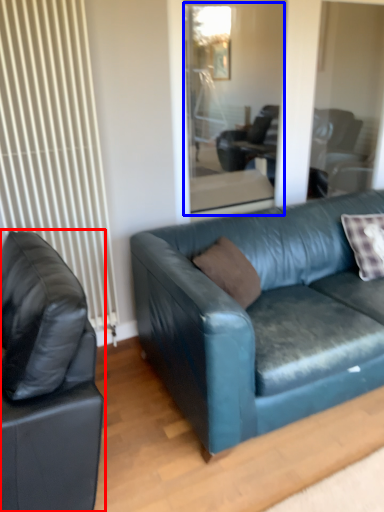
Question: Which point is closer to the camera, studio couch (highlighted by a red box) or glass door (highlighted by a blue box)?

Choices:
 (A) studio couch
 (B) glass door

Answer: (A)